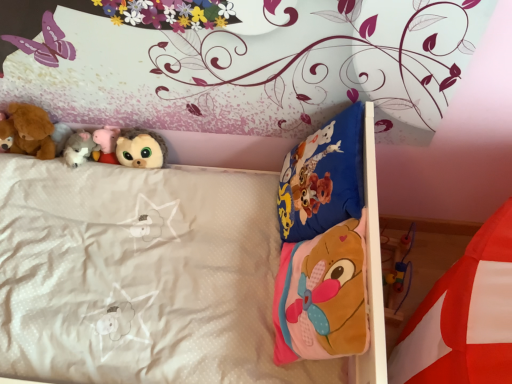
Question: In terms of width, does pink plush pig at upper left, which ranks as the 4th toy in left-to-right order, look wider or thinner when compared to soft brown teddy bear at left, the 4th toy from the right?

Choices:
 (A) wide
 (B) thin

Answer: (B)

Question: From a real-world perspective, relative to soft brown teddy bear at left, which appears as the 2th toy when viewed from the left, is pink plush pig at upper left, the second toy in the right-to-left sequence, vertically above or below?

Choices:
 (A) below
 (B) above

Answer: (A)

Question: Which of these objects is positioned farthest from the brown plush bear at left, which is the first toy from left to right?

Choices:
 (A) fluffy brown plush at upper center, positioned as the first toy in right-to-left order
 (B) soft brown teddy bear at left, which appears as the 2th toy when viewed from the left
 (C) soft pink fabric mattress at lower right
 (D) white plush toy at upper left, arranged as the third toy when viewed from the left
 (E) pink plush pig at upper left, which ranks as the 4th toy in left-to-right order

Answer: (C)

Question: Considering the real-world distances, which object is farthest from the soft pink fabric mattress at lower right?

Choices:
 (A) pink plush pig at upper left, which ranks as the 4th toy in left-to-right order
 (B) soft brown teddy bear at left, the 4th toy from the right
 (C) brown plush bear at left, which is the fifth toy in right-to-left order
 (D) white plush toy at upper left, arranged as the third toy when viewed from the left
 (E) fluffy brown plush at upper center, arranged as the 5th toy when viewed from the left

Answer: (C)